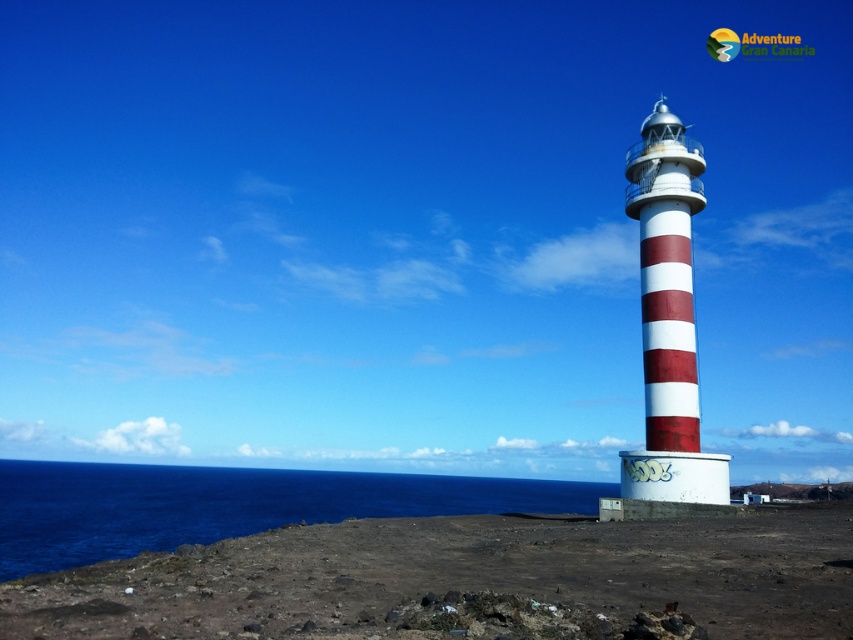
Question: Which object is positioned farthest from the red and white striped tower at right?

Choices:
 (A) deep blue water at lower left
 (B) brown rocky shore at lower right

Answer: (A)

Question: Can you confirm if brown rocky shore at lower right is positioned to the left of red and white striped tower at right?

Choices:
 (A) no
 (B) yes

Answer: (B)

Question: Which of the following is the closest to the observer?

Choices:
 (A) brown rocky shore at lower right
 (B) red and white striped tower at right
 (C) deep blue water at lower left

Answer: (A)

Question: Does deep blue water at lower left come behind red and white striped tower at right?

Choices:
 (A) no
 (B) yes

Answer: (B)

Question: Can you confirm if deep blue water at lower left is smaller than red and white striped tower at right?

Choices:
 (A) yes
 (B) no

Answer: (B)

Question: Which object appears farthest from the camera in this image?

Choices:
 (A) deep blue water at lower left
 (B) brown rocky shore at lower right
 (C) red and white striped tower at right

Answer: (A)